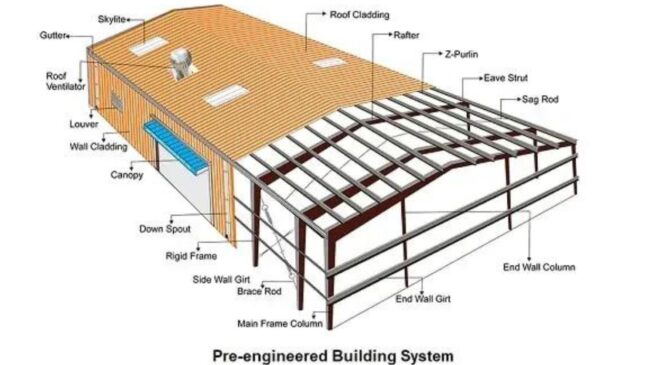
This screenshot has height=365, width=650. I want to click on beam, so [309, 154].